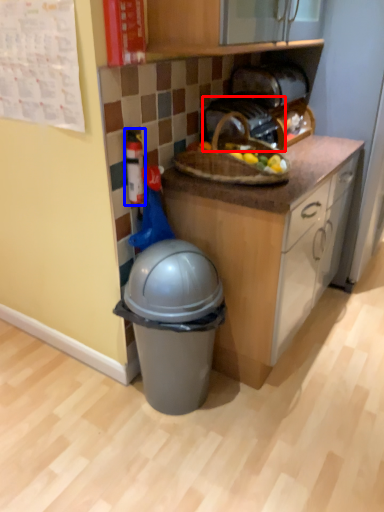
Question: Which object is closer to the camera taking this photo, toaster (highlighted by a red box) or toy (highlighted by a blue box)?

Choices:
 (A) toaster
 (B) toy

Answer: (B)